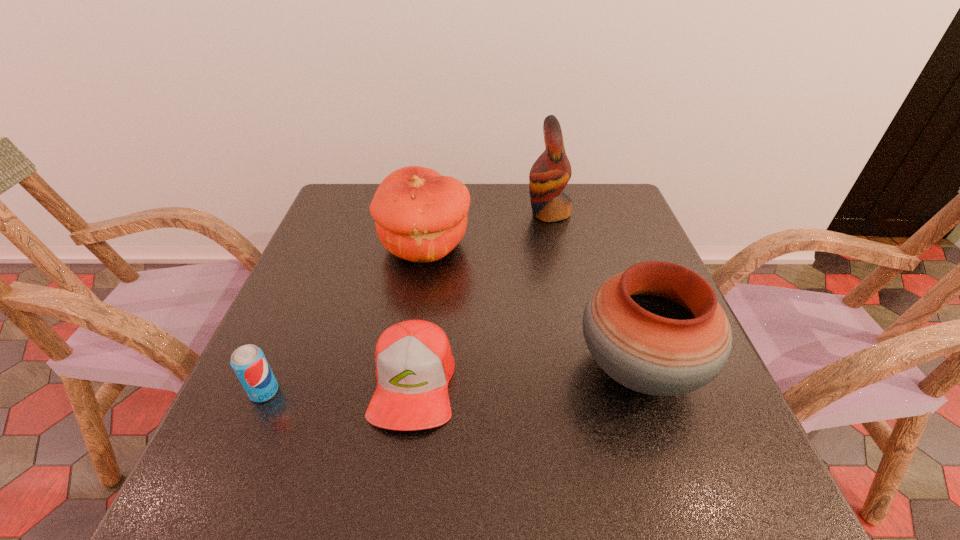
The width and height of the screenshot is (960, 540). In order to click on free region at the near left corner of the desktop in this screenshot , I will do `click(179, 510)`.

Where is `vacant space at the far right corner`? vacant space at the far right corner is located at coordinates (586, 205).

You are a GUI agent. You are given a task and a screenshot of the screen. Output one action in this format:
    pyautogui.click(x=<x>, y=<y>)
    Task: Click on the free space at the near right corner of the desktop
    
    Given the screenshot: What is the action you would take?
    pyautogui.click(x=729, y=462)

Find the location of a particular element. The width and height of the screenshot is (960, 540). blank region between the pumpkin and the leftmost object is located at coordinates (345, 319).

At what (x,y) coordinates should I click in order to perform the action: click on free space between the pottery and the pumpkin. Please return your answer as a coordinate pair (x, y). Looking at the image, I should click on (533, 307).

Locate an element on the screen. free spot between the parrot and the baseball cap is located at coordinates (481, 298).

Identify the location of vacant area between the pottery and the baseball cap. The image size is (960, 540). (526, 375).

Find the location of a particular element. The image size is (960, 540). free spot between the pumpkin and the baseball cap is located at coordinates (420, 315).

Find the location of a particular element. Image resolution: width=960 pixels, height=540 pixels. vacant space that is in between the leftmost object and the pumpkin is located at coordinates (345, 319).

You are a GUI agent. You are given a task and a screenshot of the screen. Output one action in this format:
    pyautogui.click(x=<x>, y=<y>)
    Task: Click on the vacant space in between the pottery and the pumpkin
    The width and height of the screenshot is (960, 540).
    Given the screenshot: What is the action you would take?
    pyautogui.click(x=533, y=307)